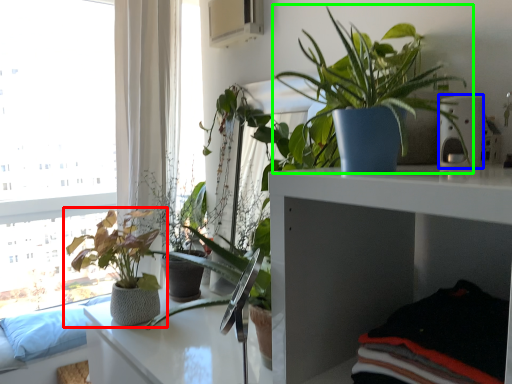
Question: Estimate the real-world distances between objects in this image. Which object is farther from houseplant (highlighted by a red box), appliance (highlighted by a blue box) or houseplant (highlighted by a green box)?

Choices:
 (A) appliance
 (B) houseplant

Answer: (A)